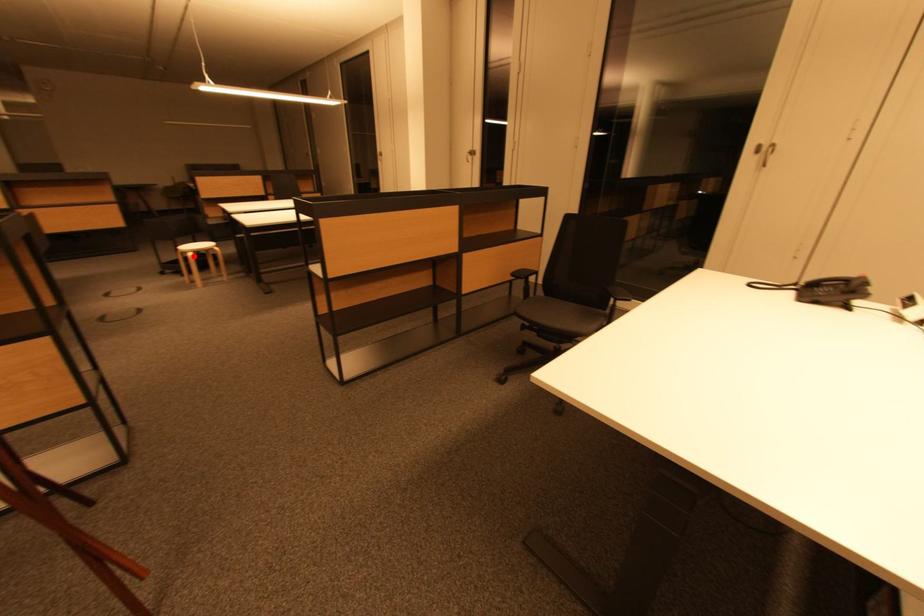
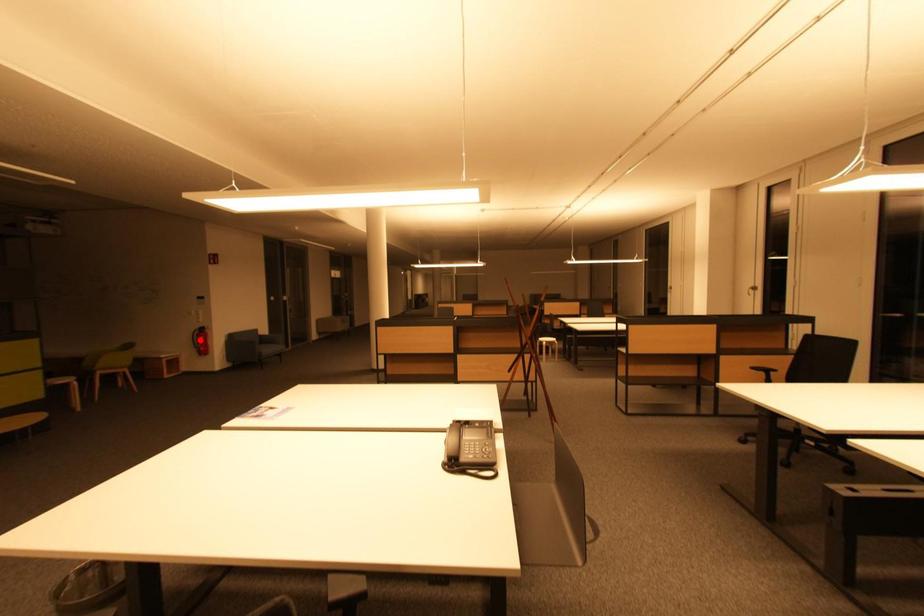
I am providing you with two images of the same scene from different viewpoints. A red point is marked on the first image and another point is marked on the second image. Are the points marked in image1 and image2 representing the same 3D position?

No